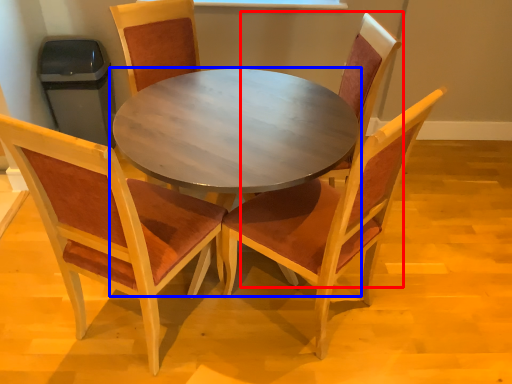
Question: Among these objects, which one is nearest to the camera, chair (highlighted by a red box) or coffee table (highlighted by a blue box)?

Choices:
 (A) chair
 (B) coffee table

Answer: (B)